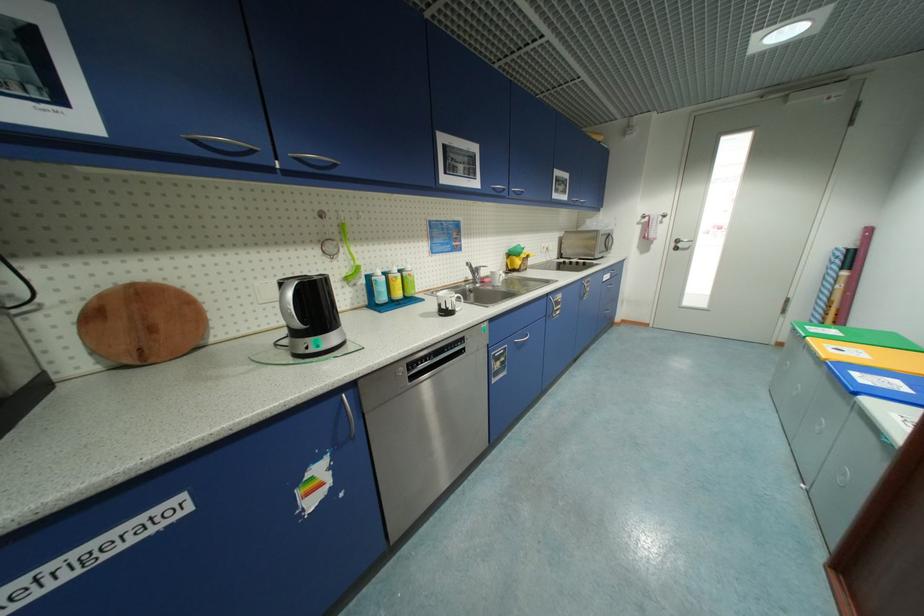
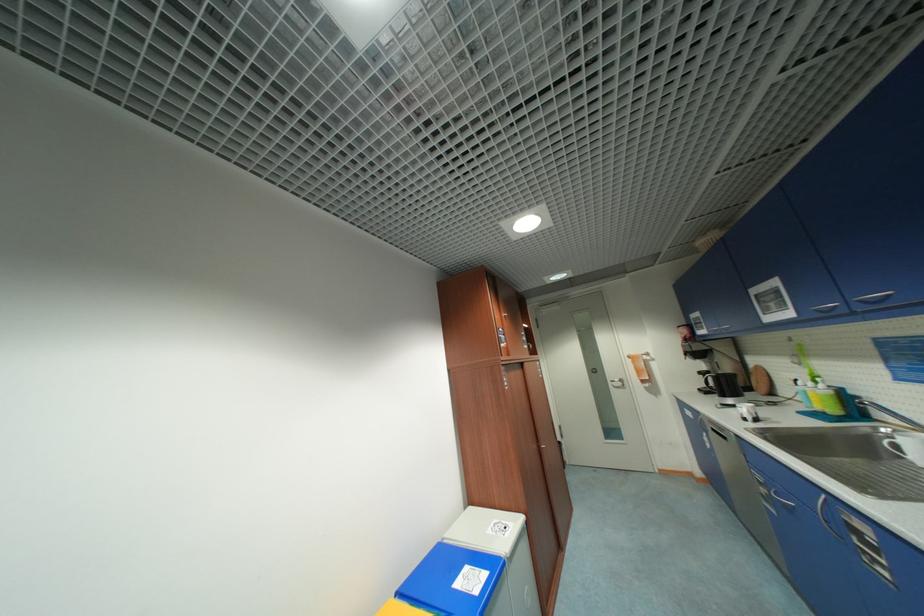
In the second image, find the point that corresponds to pixel 499 190 in the first image.

(822, 312)